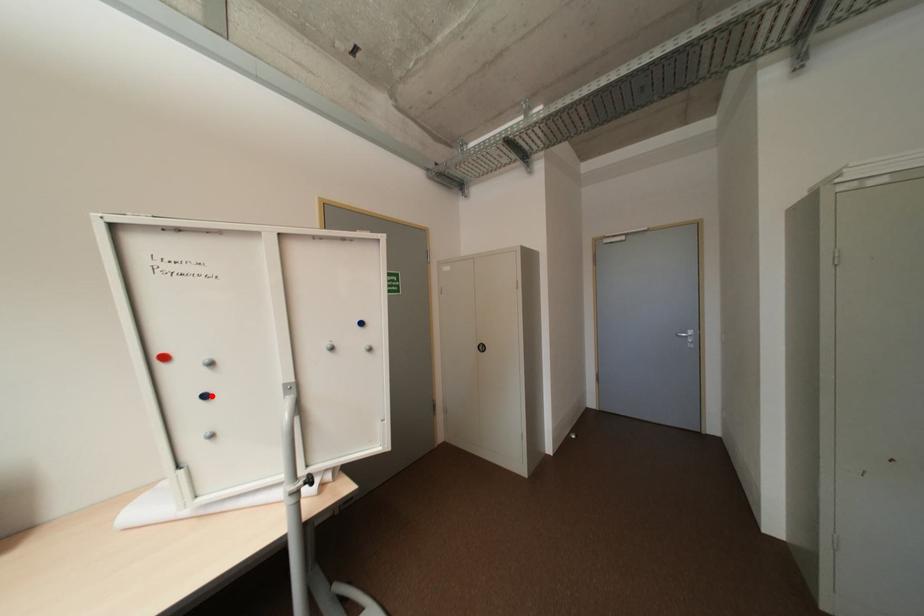
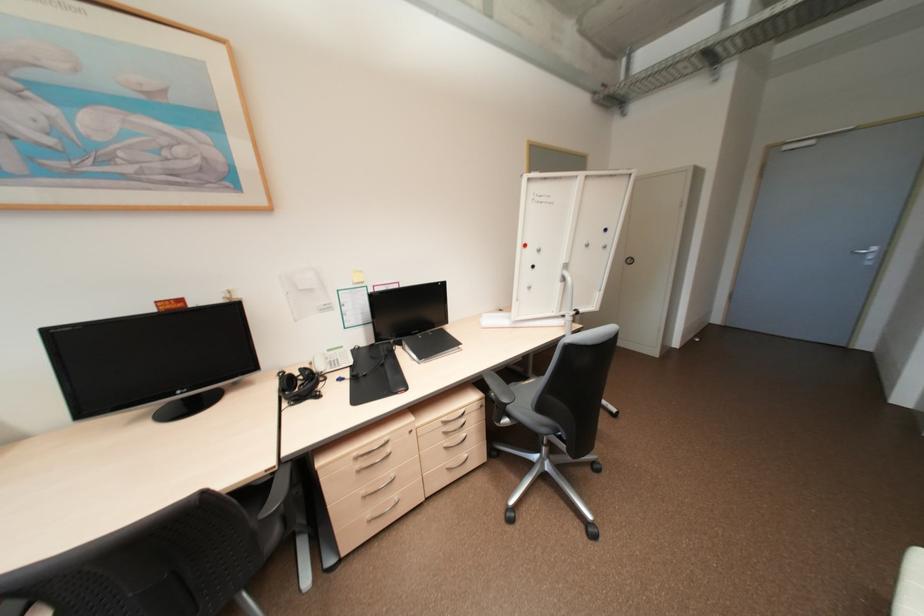
Where in the second image is the point corresponding to the highlighted location from the first image?

(539, 265)